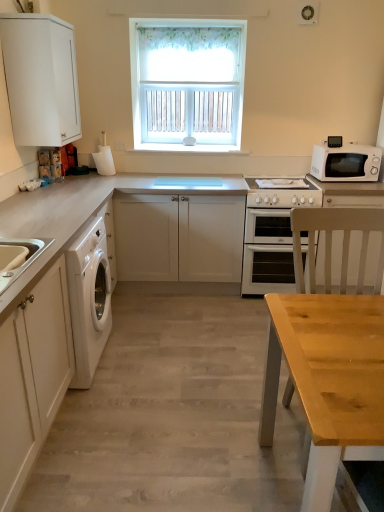
You are a GUI agent. You are given a task and a screenshot of the screen. Output one action in this format:
    pyautogui.click(x=<x>, y=<y>)
    Task: Click on the vacant position to the left of light wood chair at right
    The height and width of the screenshot is (512, 384).
    Given the screenshot: What is the action you would take?
    pyautogui.click(x=227, y=429)